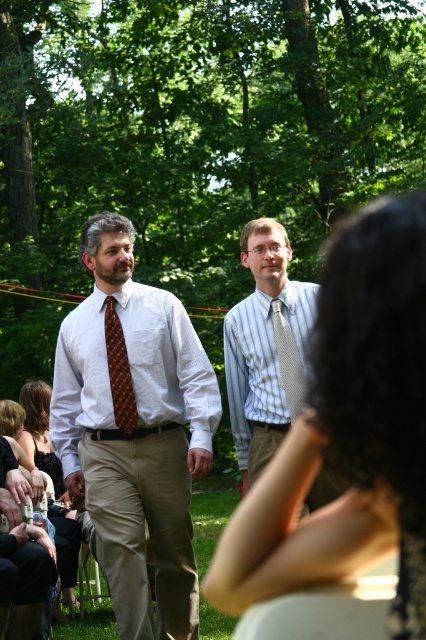
Can you confirm if matte khaki pants at center is shorter than matte brown tie at center?

Indeed, matte khaki pants at center has a lesser height compared to matte brown tie at center.

Is point (328, 454) farther from camera compared to point (150, 314)?

No, it is not.

Find the location of `matte khaki pants at center`. matte khaki pants at center is located at coordinates 348,433.

Image resolution: width=426 pixels, height=640 pixels. What do you see at coordinates (167, 362) in the screenshot? I see `white woven shirt at left` at bounding box center [167, 362].

In the scene shown: Which is more to the left, white woven shirt at left or silver textured tie at center?

white woven shirt at left

Between point (92, 397) and point (287, 403), which one is positioned in front?

Point (287, 403)

Where is `white woven shirt at left`? The width and height of the screenshot is (426, 640). white woven shirt at left is located at coordinates (167, 362).

Is point (201, 445) positioned behind point (169, 333)?

No.

Which is behind, point (78, 488) or point (126, 340)?

Point (78, 488)

Where is `matte brown tie at center`? The image size is (426, 640). matte brown tie at center is located at coordinates (135, 429).